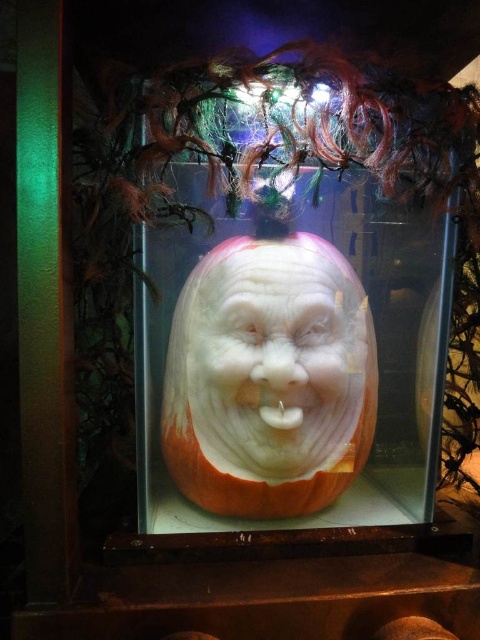
Question: Is smooth white pumpkin at center bigger than white carved nose at center?

Choices:
 (A) no
 (B) yes

Answer: (B)

Question: Which point is farther from the camera taking this photo?

Choices:
 (A) (240, 362)
 (B) (276, 388)

Answer: (B)

Question: Does transparent glass pumpkin at center have a larger size compared to smooth white pumpkin at center?

Choices:
 (A) no
 (B) yes

Answer: (B)

Question: In this image, where is transparent glass pumpkin at center located relative to smooth white pumpkin at center?

Choices:
 (A) left
 (B) right

Answer: (B)

Question: Which object appears closest to the camera in this image?

Choices:
 (A) white carved nose at center
 (B) smooth white pumpkin at center

Answer: (A)

Question: Estimate the real-world distances between objects in this image. Which object is closer to the smooth white pumpkin at center?

Choices:
 (A) white carved nose at center
 (B) transparent glass pumpkin at center

Answer: (B)